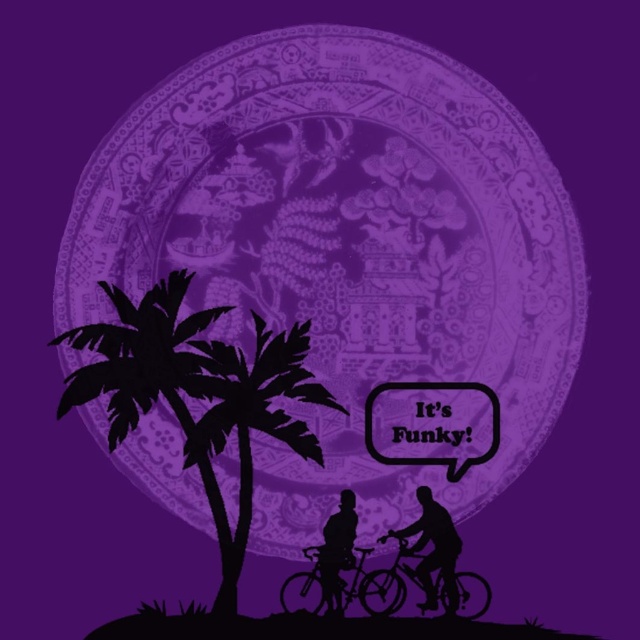
You are a tourist in this tropical scene and want to take a photo of the black silhouette palm tree at left and the metallic bicycle at center. Which object should you place on the left side of your camera frame to capture both in the scene as shown?

To capture both the black silhouette palm tree at left and the metallic bicycle at center in the scene as shown, you should place the black silhouette palm tree at left on the left side of your camera frame since it is already positioned on the left side of the metallic bicycle at center in the image.

You are a photographer planning to capture a photo of the scene. You want to ensure that both the black silhouette palm tree at left and the metallic bicycle at center are clearly visible. Given their height difference, which object should you focus on first to ensure proper framing?

The black silhouette palm tree at left is taller than the metallic bicycle at center, so you should focus on the black silhouette palm tree at left first to ensure proper framing.

You are standing in the scene and want to walk towards the two points labeled point (339, 449) and point (419, 557). Which point will you reach first?

You will reach point (339, 449) first because it is closer to you than point (419, 557), which is further away.